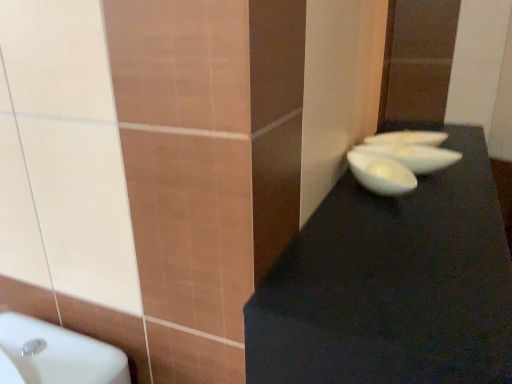
Find the location of a particular element. This screenshot has width=512, height=384. free space in front of white glossy bowl at center, the 2th basin in the back-to-front sequence is located at coordinates (442, 192).